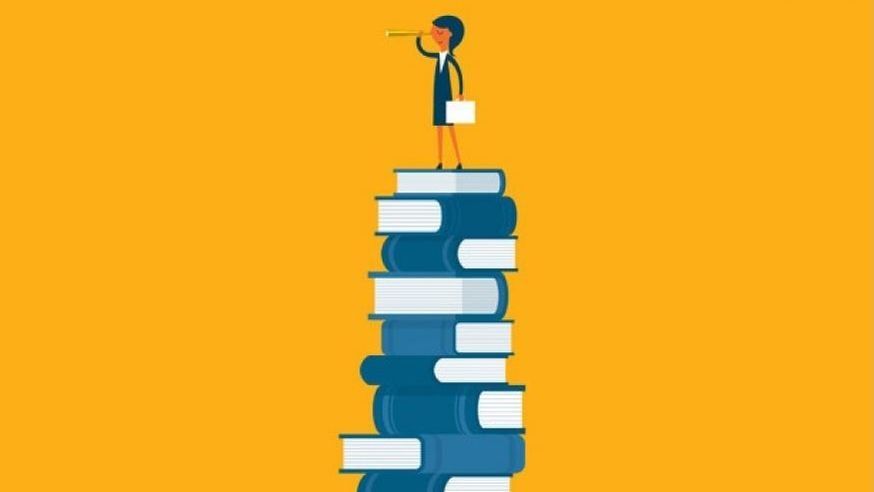
Where is `books with spines facing to the right`? The image size is (874, 492). books with spines facing to the right is located at coordinates (462, 451), (453, 295), (458, 182), (459, 212).